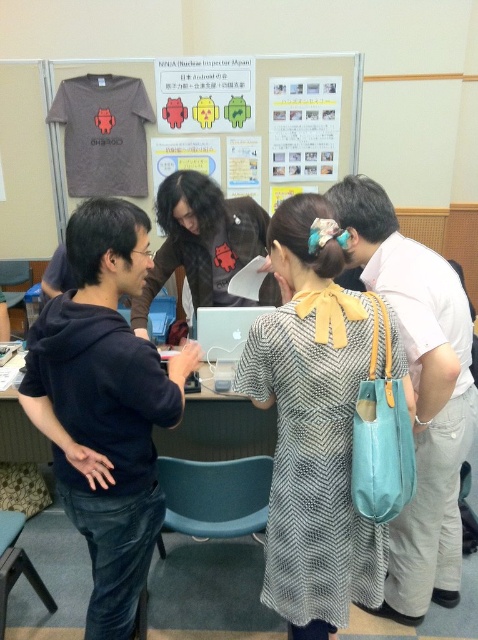
Question: Does matte black shirt at center have a larger size compared to matte plastic android figures at upper center?

Choices:
 (A) no
 (B) yes

Answer: (B)

Question: Does patterned fabric dress at center have a lesser width compared to matte black shirt at center?

Choices:
 (A) yes
 (B) no

Answer: (A)

Question: Which object is positioned farthest from the matte plastic android figures at upper center?

Choices:
 (A) matte black shirt at center
 (B) light blue fabric bag at right

Answer: (B)

Question: Considering the real-world distances, which object is closest to the matte plastic android figures at upper center?

Choices:
 (A) black hoodie at left
 (B) white paper at upper center

Answer: (B)

Question: Is patterned fabric dress at center positioned before silver metallic laptop at center?

Choices:
 (A) no
 (B) yes

Answer: (B)

Question: Which of these objects is positioned closest to the matte black shirt at center?

Choices:
 (A) silver metallic laptop at center
 (B) matte plastic android figures at upper center
 (C) white paper at upper center
 (D) black hoodie at left

Answer: (A)